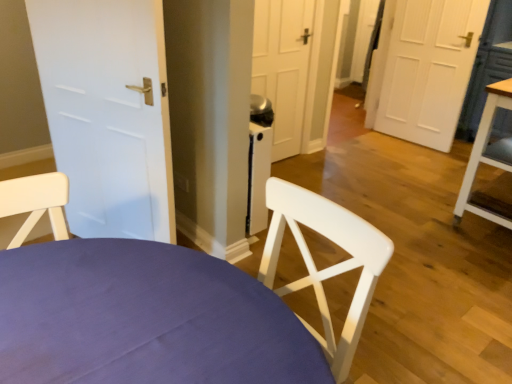
Question: Does white matte door at left turn towards white wood chair at center?

Choices:
 (A) no
 (B) yes

Answer: (A)

Question: From a real-world perspective, is white matte door at left below white wood chair at center?

Choices:
 (A) no
 (B) yes

Answer: (A)

Question: Does white matte door at left have a smaller size compared to white wood chair at center?

Choices:
 (A) yes
 (B) no

Answer: (A)

Question: Considering the relative positions of white matte door at left and white wood chair at center in the image provided, is white matte door at left to the left of white wood chair at center from the viewer's perspective?

Choices:
 (A) yes
 (B) no

Answer: (A)

Question: From the image's perspective, is white matte door at left over white wood chair at center?

Choices:
 (A) no
 (B) yes

Answer: (B)

Question: From a real-world perspective, is white matte door at left on white wood chair at center?

Choices:
 (A) no
 (B) yes

Answer: (B)

Question: From the image's perspective, does wooden table at right appear lower than white wood chair at center?

Choices:
 (A) yes
 (B) no

Answer: (B)

Question: Does wooden table at right appear on the right side of white wood chair at center?

Choices:
 (A) yes
 (B) no

Answer: (A)

Question: Can you confirm if wooden table at right is thinner than white wood chair at center?

Choices:
 (A) yes
 (B) no

Answer: (A)

Question: Is wooden table at right smaller than white wood chair at center?

Choices:
 (A) yes
 (B) no

Answer: (A)

Question: Can you confirm if wooden table at right is bigger than white wood chair at center?

Choices:
 (A) yes
 (B) no

Answer: (B)

Question: Is wooden table at right facing towards white wood chair at center?

Choices:
 (A) no
 (B) yes

Answer: (A)

Question: Is white matte door at left oriented towards wooden table at right?

Choices:
 (A) no
 (B) yes

Answer: (A)